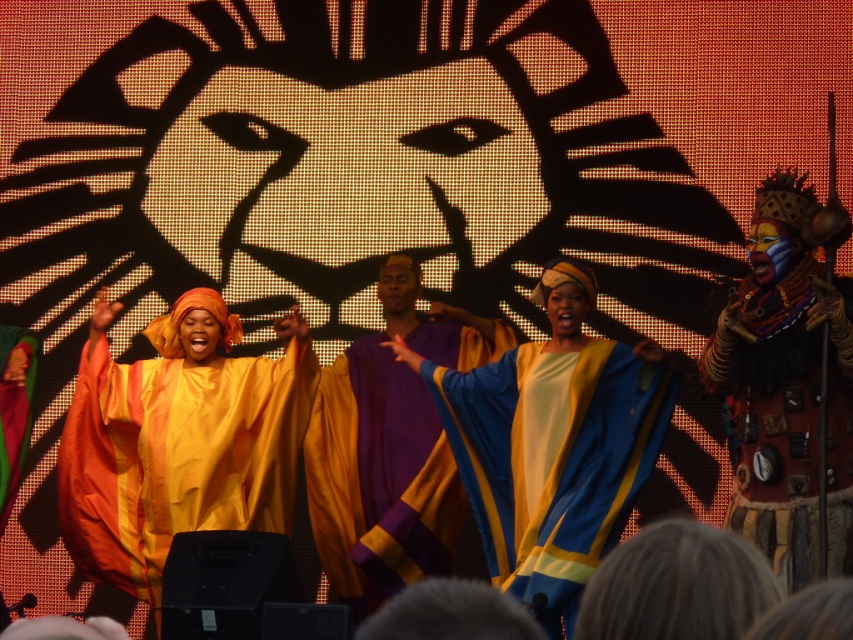
Question: Among these objects, which one is farthest from the camera?

Choices:
 (A) purple satin robe at center
 (B) matte yellow robe at center
 (C) leather-like brown mask at right
 (D) silky yellow robe at center

Answer: (A)

Question: Does matte yellow robe at center lie in front of purple satin robe at center?

Choices:
 (A) no
 (B) yes

Answer: (B)

Question: Which of these objects is positioned farthest from the matte yellow robe at center?

Choices:
 (A) purple satin robe at center
 (B) silky yellow robe at center
 (C) leather-like brown mask at right

Answer: (C)

Question: Considering the relative positions of purple satin robe at center and leather-like brown mask at right in the image provided, where is purple satin robe at center located with respect to leather-like brown mask at right?

Choices:
 (A) below
 (B) above

Answer: (A)

Question: Among these objects, which one is farthest from the camera?

Choices:
 (A) matte yellow robe at center
 (B) silky yellow robe at center
 (C) leather-like brown mask at right

Answer: (A)

Question: Can you confirm if silky yellow robe at center is positioned to the left of leather-like brown mask at right?

Choices:
 (A) no
 (B) yes

Answer: (B)